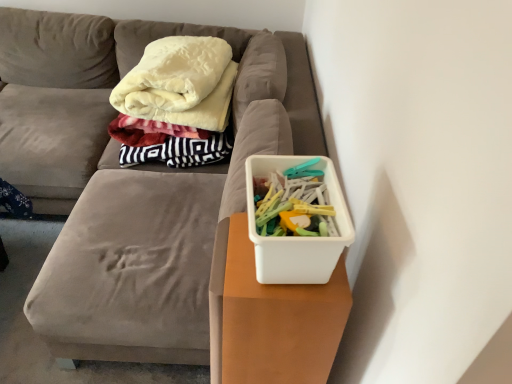
Question: Would you say white plastic container at center contains white plastic container at right?

Choices:
 (A) yes
 (B) no

Answer: (B)

Question: Can you confirm if white plastic container at center is thinner than white plastic container at right?

Choices:
 (A) no
 (B) yes

Answer: (A)

Question: Considering the relative sizes of white plastic container at center and white plastic container at right in the image provided, is white plastic container at center bigger than white plastic container at right?

Choices:
 (A) yes
 (B) no

Answer: (A)

Question: Does white plastic container at center have a greater width compared to white plastic container at right?

Choices:
 (A) yes
 (B) no

Answer: (A)

Question: Can you confirm if white plastic container at center is positioned to the right of white plastic container at right?

Choices:
 (A) yes
 (B) no

Answer: (B)

Question: In terms of width, does white plastic container at right look wider or thinner when compared to white plastic container at right?

Choices:
 (A) thin
 (B) wide

Answer: (A)

Question: Based on their sizes in the image, would you say white plastic container at right is bigger or smaller than white plastic container at right?

Choices:
 (A) big
 (B) small

Answer: (B)

Question: Considering the positions of point (333, 203) and point (304, 375), is point (333, 203) closer or farther from the camera than point (304, 375)?

Choices:
 (A) closer
 (B) farther

Answer: (A)

Question: From a real-world perspective, is white plastic container at right above or below white plastic container at right?

Choices:
 (A) above
 (B) below

Answer: (A)

Question: Considering the positions of point (345, 304) and point (154, 208), is point (345, 304) closer or farther from the camera than point (154, 208)?

Choices:
 (A) closer
 (B) farther

Answer: (A)

Question: Considering the positions of white plastic container at right and white plastic container at center in the image, is white plastic container at right taller or shorter than white plastic container at center?

Choices:
 (A) tall
 (B) short

Answer: (A)

Question: Is white plastic container at right wider or thinner than white plastic container at center?

Choices:
 (A) thin
 (B) wide

Answer: (A)

Question: Which is correct: white plastic container at right is inside white plastic container at center, or outside of it?

Choices:
 (A) outside
 (B) inside

Answer: (A)

Question: Visually, is white plastic container at center positioned to the left or to the right of white plastic container at right?

Choices:
 (A) left
 (B) right

Answer: (A)

Question: Considering the positions of white plastic container at center and white plastic container at right in the image, is white plastic container at center bigger or smaller than white plastic container at right?

Choices:
 (A) small
 (B) big

Answer: (B)